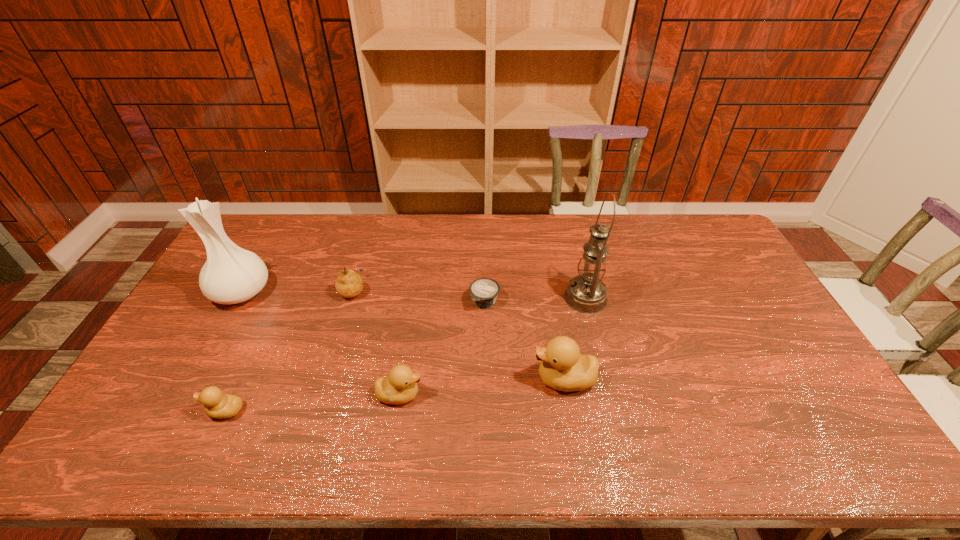
Where is `object at the left edge`? object at the left edge is located at coordinates (231, 274).

Locate an element on the screen. The image size is (960, 540). free space at the far edge of the desktop is located at coordinates (670, 228).

In the image, there is a desktop. Identify the location of vacant space at the near edge. This screenshot has width=960, height=540. (652, 414).

In the image, there is a desktop. At what (x,y) coordinates should I click in order to perform the action: click on vacant space at the right edge. Please return your answer as a coordinate pair (x, y). This screenshot has width=960, height=540. Looking at the image, I should click on click(x=740, y=288).

Find the location of a particular element. vacant space at the far left corner of the desktop is located at coordinates (271, 241).

Image resolution: width=960 pixels, height=540 pixels. I want to click on free space that is in between the vase and the leftmost duckling, so click(x=233, y=352).

Find the location of a particular element. free spot between the vase and the fourth object from left to right is located at coordinates tap(321, 343).

Identify the location of free point between the tallest duckling and the second tallest duckling. (482, 387).

Locate an element on the screen. The width and height of the screenshot is (960, 540). free space between the vase and the tallest duckling is located at coordinates [403, 335].

Where is `free spot between the pear and the shortest duckling`? Image resolution: width=960 pixels, height=540 pixels. free spot between the pear and the shortest duckling is located at coordinates (289, 350).